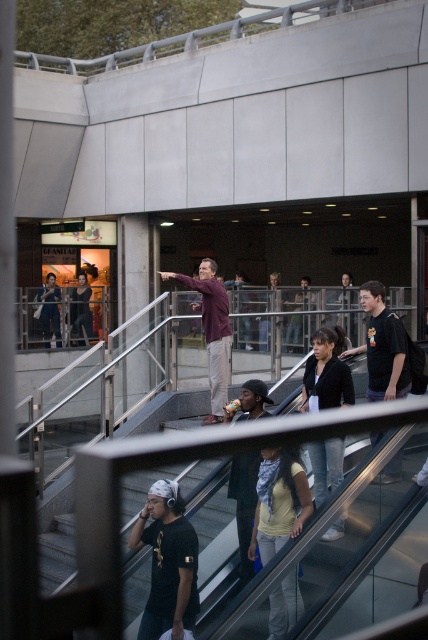
You are a delivery person carrying a package and need to place it on the maroon fabric skateboard at center. However, there is a denim jacket at lower right in the way. Can you place the package on the skateboard without moving the jacket?

The denim jacket at lower right is located above the maroon fabric skateboard at center, so you can place the package on the skateboard without moving the jacket because the jacket is positioned above it and not blocking access.

You are standing at the entrance of the urban scene and want to locate the point marked at coordinates (279, 500). According to the scene description, where exactly is this point located?

The point marked at coordinates (279, 500) is located on the yellow matte shirt at lower center.

You are standing at the bottom of the escalator and see the denim jacket at lower right and the maroon fabric skateboard at center. Which object is closer to your right side?

The denim jacket at lower right is positioned on the right side of maroon fabric skateboard at center, so it is closer to your right side.